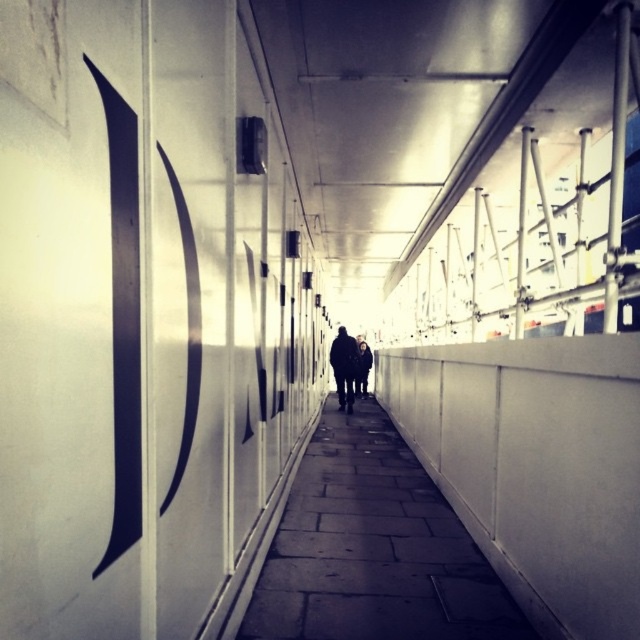
In the scene shown: You are a delivery person carrying a large box and need to walk through the narrow walkway. The dark gray stone pavement at center and the dark gray jacket at center are both in your path. Since you need to avoid stepping on the jacket, which object should you step on and why?

You should step on the dark gray stone pavement at center because its width surpasses that of the dark gray jacket at center, providing a wider and safer path to avoid the jacket.

From the picture: You are a delivery person carrying a large package and need to walk through the narrow walkway. You see the dark gray stone pavement at center and the dark gray jacket at center. Which object should you avoid stepping on to ensure your package stays clean?

You should avoid stepping on the dark gray stone pavement at center because it has a smaller size compared to the dark gray jacket at center, making it less stable and more likely to cause spills.

You are standing at the entrance of a narrow walkway with white walls. You see a dark gray stone pavement at center and a dark wool coat at center. Which object is wider?

The dark gray stone pavement at center is wider than the dark wool coat at center according to the description.